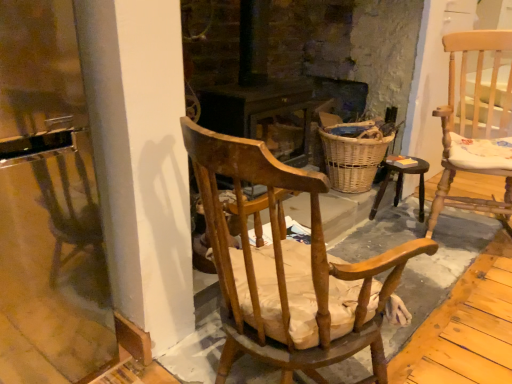
This screenshot has height=384, width=512. Find the location of `vacant point to the right of wooden stool at center`. vacant point to the right of wooden stool at center is located at coordinates (440, 222).